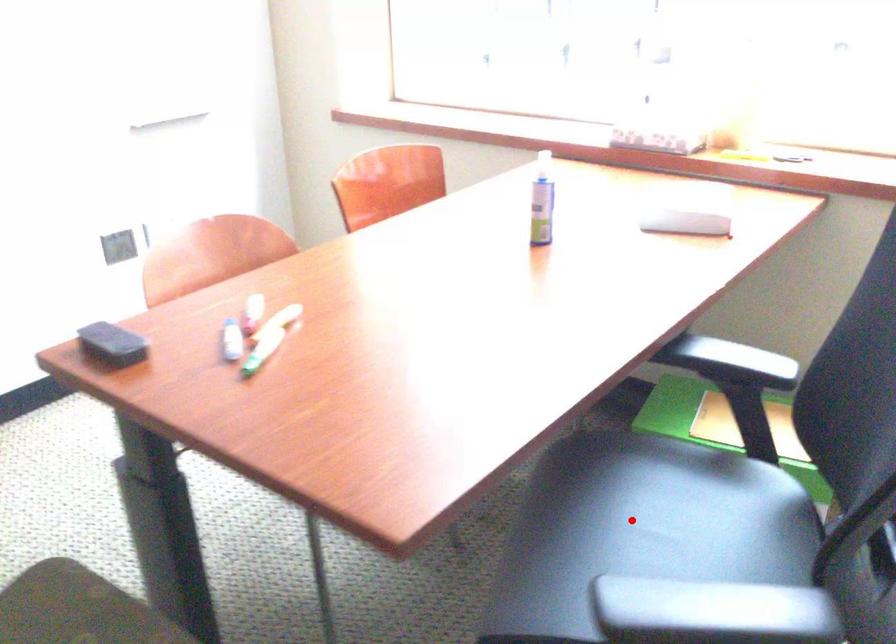
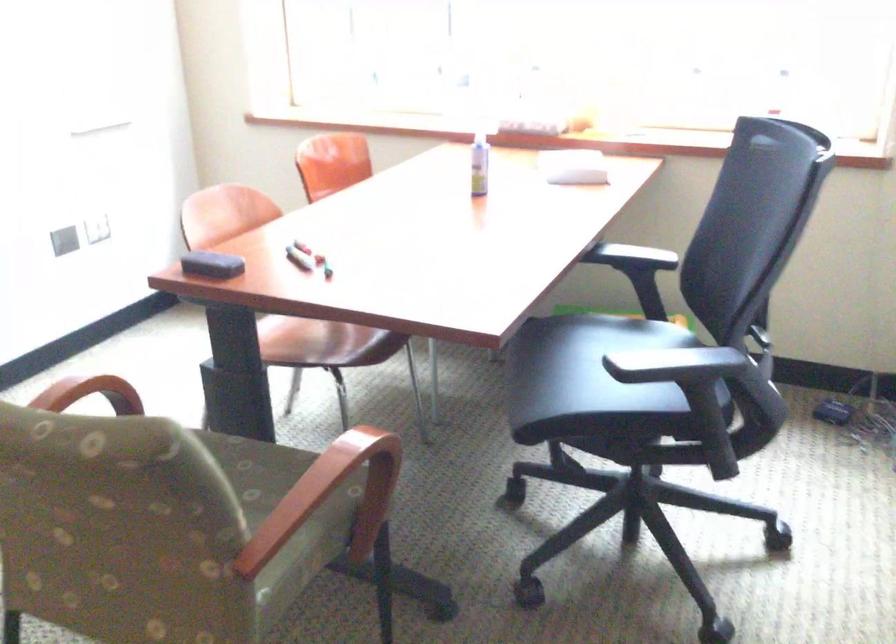
Question: I am providing you with two images of the same scene from different viewpoints. A red point is shown in image1. For the corresponding object point in image2, is it positioned nearer or farther from the camera?

Choices:
 (A) Nearer
 (B) Farther

Answer: (B)